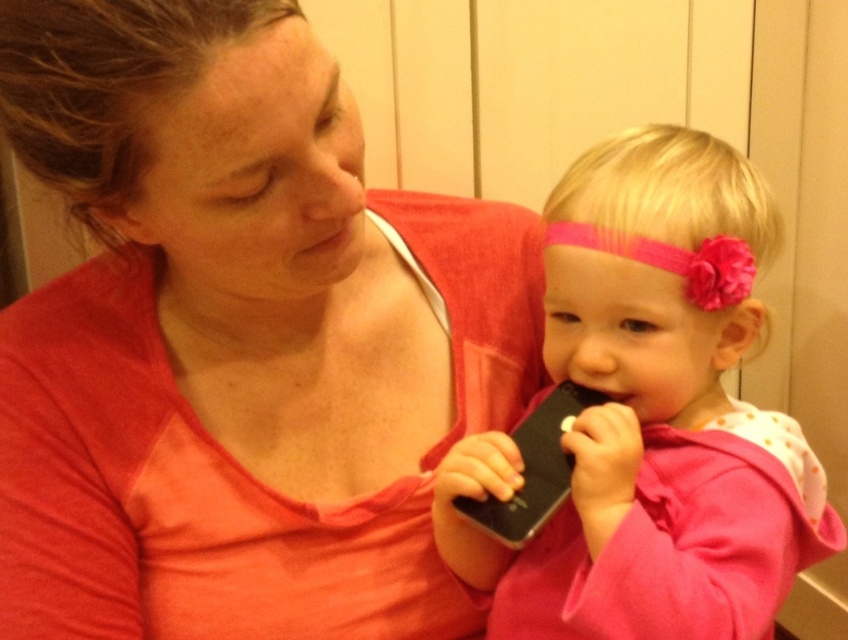
Which is above, matte pink shirt at center or pink matte phone at center?

Positioned higher is matte pink shirt at center.

Who is more forward, (79, 432) or (651, 296)?

Point (651, 296) is more forward.

Identify the location of matte pink shirt at center. click(x=237, y=339).